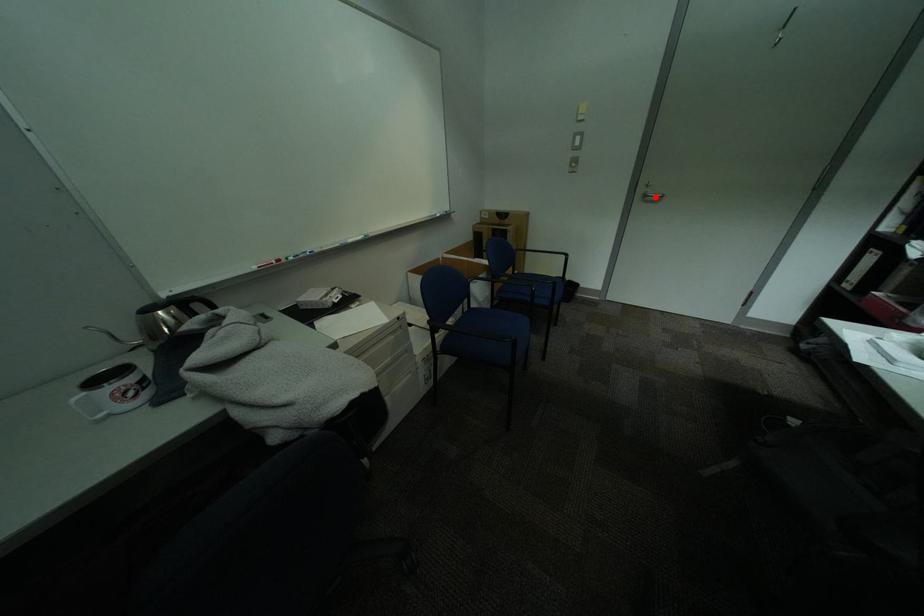
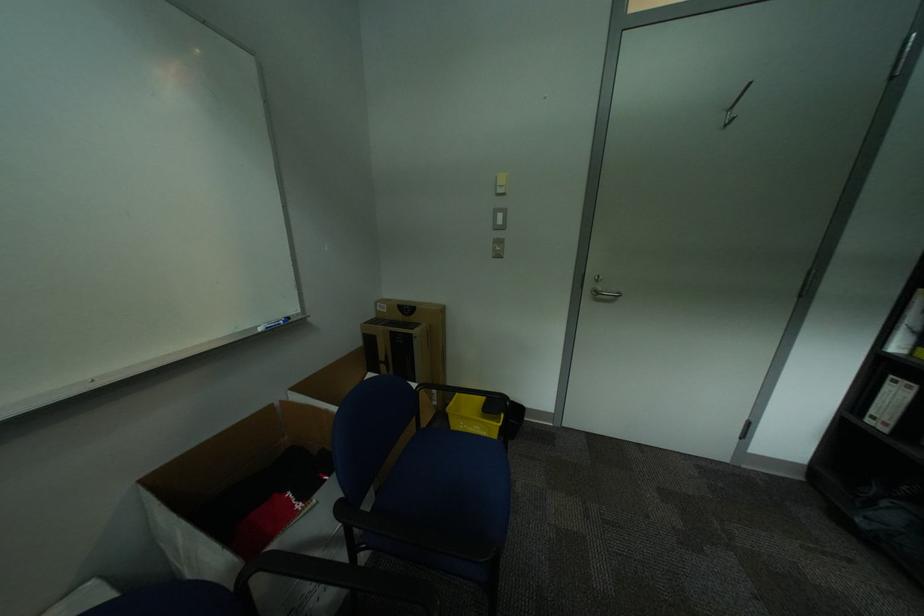
Locate, in the second image, the point that corresponds to the highlighted location in the first image.

(606, 294)